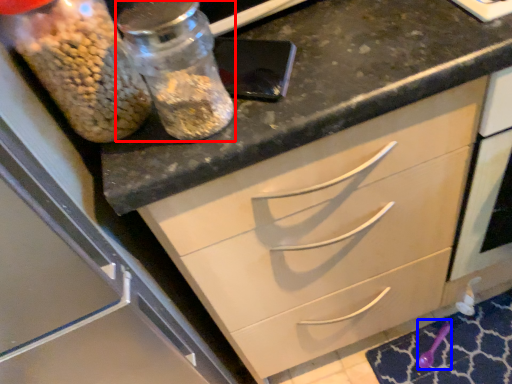
Question: Which object is closer to the camera taking this photo, glass jar (highlighted by a red box) or utensil (highlighted by a blue box)?

Choices:
 (A) glass jar
 (B) utensil

Answer: (A)